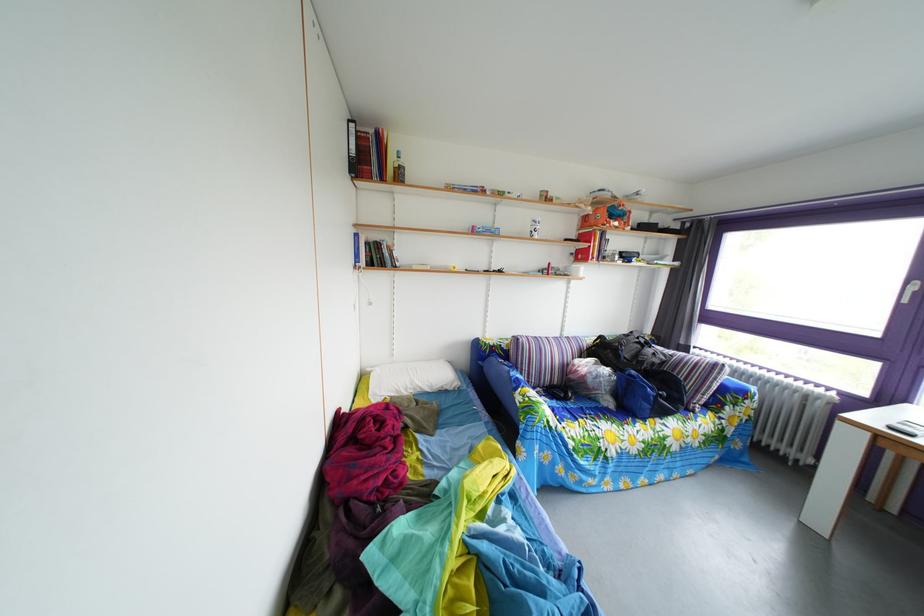
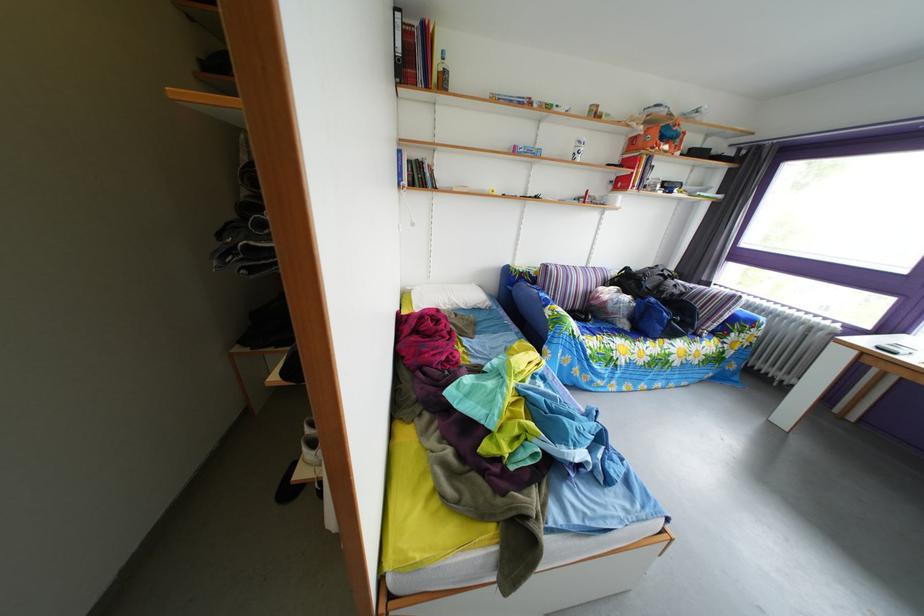
Find the pixel in the second image that matches point 643,379 in the first image.

(663, 307)